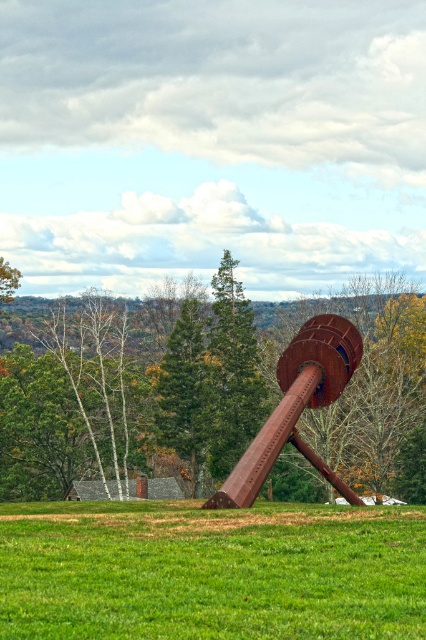
Question: Is brown textured tree at center thinner than rusty metal pole at center?

Choices:
 (A) yes
 (B) no

Answer: (B)

Question: Which point is closer to the camera taking this photo?

Choices:
 (A) (111, 458)
 (B) (296, 419)
 (C) (34, 582)

Answer: (C)

Question: Can you confirm if brown textured tree at center is thinner than green grass at lower center?

Choices:
 (A) yes
 (B) no

Answer: (B)

Question: Which object appears farthest from the camera in this image?

Choices:
 (A) green grass at lower center
 (B) brown textured tree at center
 (C) rusty metal pole at center

Answer: (B)

Question: Which object appears closest to the camera in this image?

Choices:
 (A) rusty metal pole at center
 (B) brown textured tree at center

Answer: (A)

Question: Is brown textured tree at center wider than rusty metal pole at center?

Choices:
 (A) no
 (B) yes

Answer: (B)